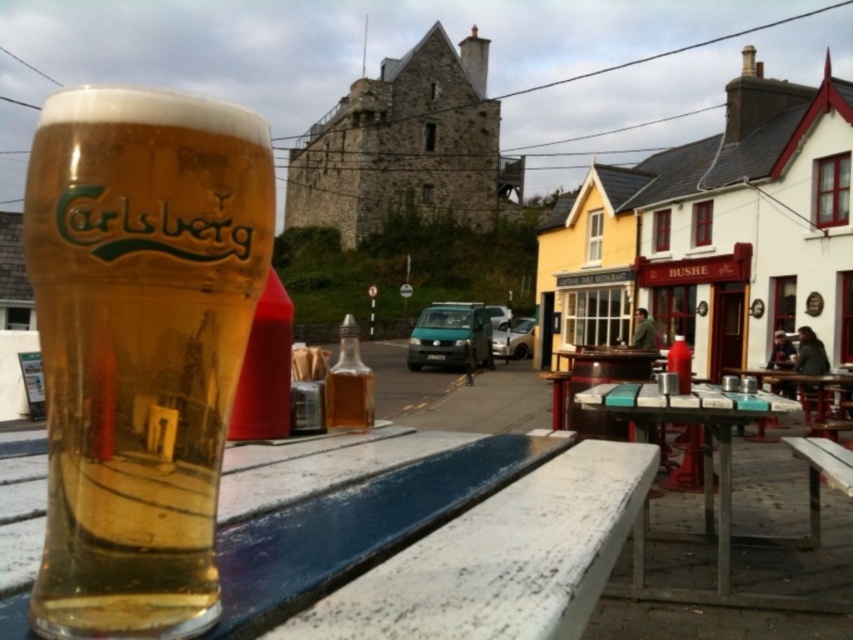
You are setting up a small tray to place both the golden glass carlsberg at left and the white painted wood table at lower center. Given their sizes, which object should you place first to ensure stability?

The golden glass carlsberg at left has a smaller width than the white painted wood table at lower center, so you should place the wider white painted wood table at lower center first to provide a stable base for the smaller object.

You are a waiter carrying a tray of drinks and need to move from the golden glass carlsberg at left to the white marble table at center. Given that your tray is 1.2 meters wide, can you safely navigate the space between them without spilling the drinks?

The distance between the golden glass carlsberg at left and the white marble table at center is 2.82 meters. Since your tray is only 1.2 meters wide, there is sufficient space to navigate safely between them without any obstruction.